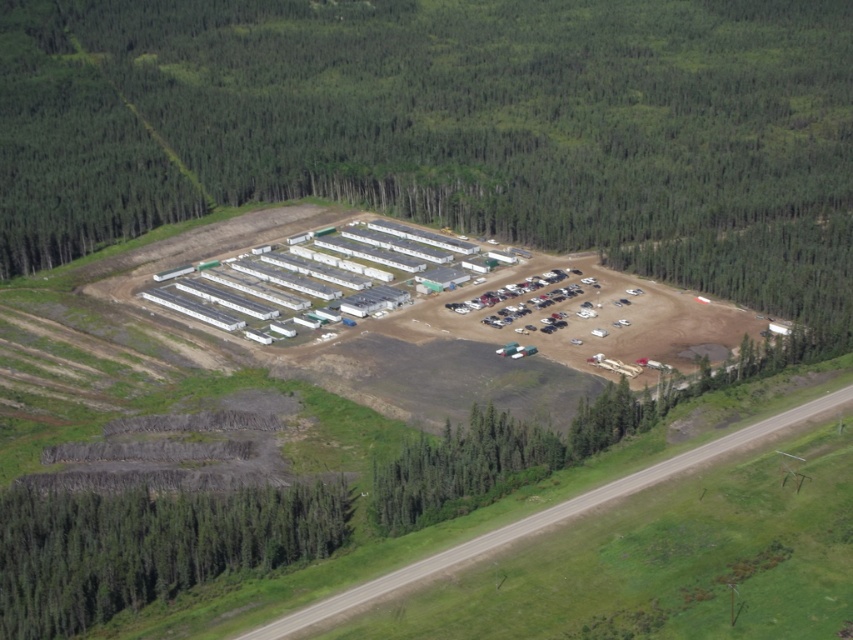
Is green leafy trees at center below green textured trees at lower left?

Incorrect, green leafy trees at center is not positioned below green textured trees at lower left.

Is green leafy trees at center wider than green textured trees at lower left?

Yes.

Is point (692, 138) positioned in front of point (310, 548)?

No, it is behind (310, 548).

Where is `green leafy trees at center`? green leafy trees at center is located at coordinates (450, 129).

Can you confirm if green textured trees at lower left is wider than metallic cars at center?

Indeed, green textured trees at lower left has a greater width compared to metallic cars at center.

Between green textured trees at lower left and metallic cars at center, which one appears on the left side from the viewer's perspective?

green textured trees at lower left is more to the left.

Locate an element on the screen. The width and height of the screenshot is (853, 640). green textured trees at lower left is located at coordinates (148, 547).

At what (x,y) coordinates should I click in order to perform the action: click on green textured trees at lower left. Please return your answer as a coordinate pair (x, y). The height and width of the screenshot is (640, 853). Looking at the image, I should click on (148, 547).

Is point (622, 132) closer to camera compared to point (582, 276)?

No.

Which of these two, green leafy trees at center or metallic cars at center, stands taller?

With more height is green leafy trees at center.

Which is in front, point (822, 243) or point (531, 280)?

Point (531, 280) is more forward.

You are a GUI agent. You are given a task and a screenshot of the screen. Output one action in this format:
    pyautogui.click(x=<x>, y=<y>)
    Task: Click on the green leafy trees at center
    The height and width of the screenshot is (640, 853).
    Given the screenshot: What is the action you would take?
    pyautogui.click(x=450, y=129)